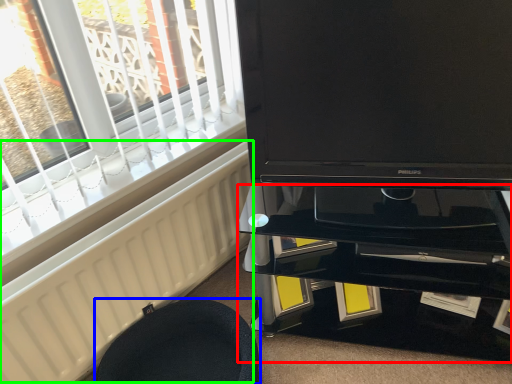
Question: Which object is the closest to the tv cabinet (highlighted by a red box)? Choose among these: furniture (highlighted by a blue box) or radiator (highlighted by a green box).

Choices:
 (A) furniture
 (B) radiator

Answer: (A)